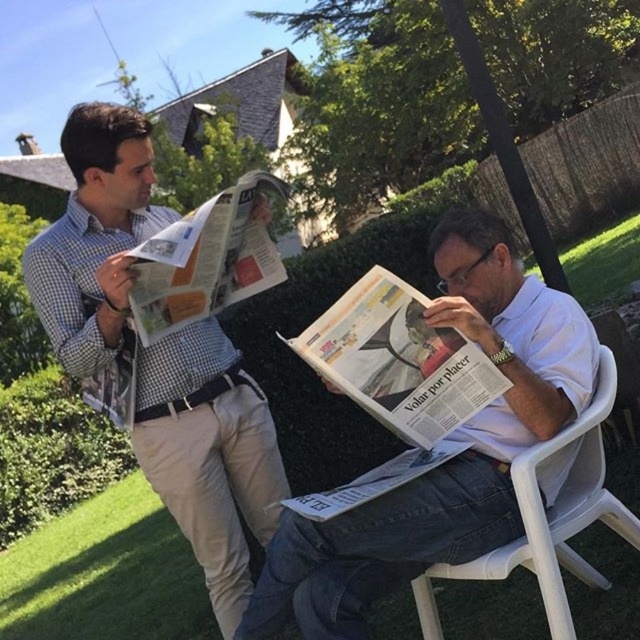
Question: Does checkered fabric shirt at left have a lesser width compared to white glossy newspaper at center?

Choices:
 (A) yes
 (B) no

Answer: (B)

Question: Which object appears farthest from the camera in this image?

Choices:
 (A) white plastic folding chair at lower right
 (B) matte newspaper at upper left

Answer: (B)

Question: Estimate the real-world distances between objects in this image. Which object is farther from the matte newspaper at upper left?

Choices:
 (A) white plastic folding chair at lower right
 (B) white paper at center
 (C) checkered fabric shirt at left

Answer: (A)

Question: Which is nearer to the matte newspaper at upper left?

Choices:
 (A) white plastic folding chair at lower right
 (B) checkered fabric shirt at left
 (C) white glossy newspaper at center

Answer: (B)

Question: Is white glossy newspaper at center closer to camera compared to white plastic folding chair at lower right?

Choices:
 (A) no
 (B) yes

Answer: (A)

Question: Can you confirm if white glossy newspaper at center is positioned above matte newspaper at upper left?

Choices:
 (A) no
 (B) yes

Answer: (A)